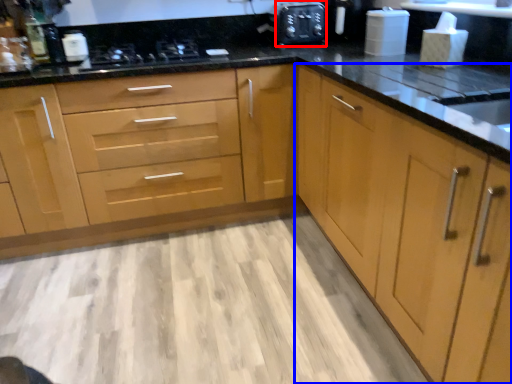
Question: Among these objects, which one is nearest to the camera, appliance (highlighted by a red box) or cabinetry (highlighted by a blue box)?

Choices:
 (A) appliance
 (B) cabinetry

Answer: (B)